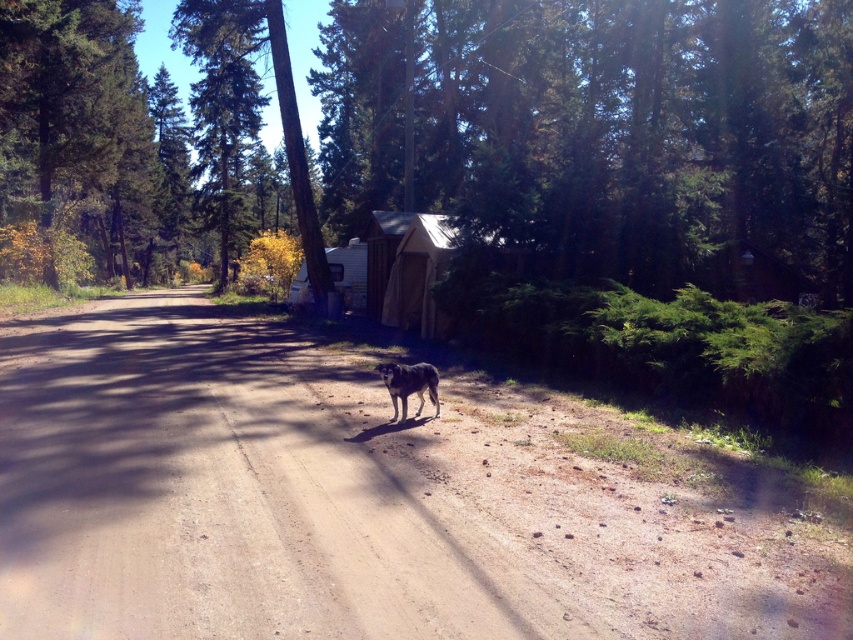
You are standing at the edge of the green leafy tree at center and want to walk to the brown dirt track at center. Which direction should you walk to reach the track?

The brown dirt track at center is positioned on the right side of green leafy tree at center, so you should walk to the right to reach the track.